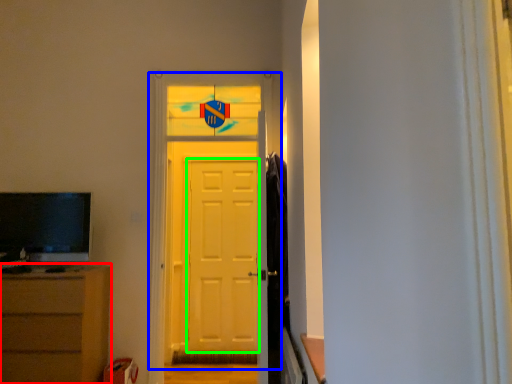
Question: Which object is the closest to the chest of drawers (highlighted by a red box)? Choose among these: door (highlighted by a blue box) or screen door (highlighted by a green box).

Choices:
 (A) door
 (B) screen door

Answer: (A)